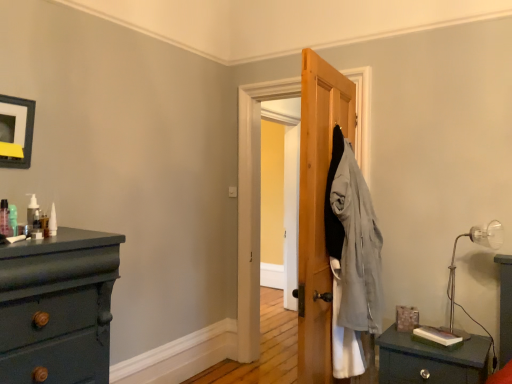
The width and height of the screenshot is (512, 384). I want to click on matte black nightstand at lower right, so click(431, 360).

Based on the photo, what is the approximate height of matte black nightstand at lower right?

matte black nightstand at lower right is 15.87 inches tall.

What do you see at coordinates (16, 131) in the screenshot? This screenshot has height=384, width=512. I see `matte black picture frame at upper left` at bounding box center [16, 131].

Where is `translucent plastic pump at left, which is the 3th toiletry from back to front`? Image resolution: width=512 pixels, height=384 pixels. translucent plastic pump at left, which is the 3th toiletry from back to front is located at coordinates (5, 219).

The image size is (512, 384). What do you see at coordinates (52, 222) in the screenshot? I see `white matte bottle at upper left, the 3th toiletry from the left` at bounding box center [52, 222].

This screenshot has height=384, width=512. I want to click on translucent plastic pump at left, which ranks as the second toiletry in right-to-left order, so click(x=32, y=211).

Locate an element on the screen. matte black nightstand at lower right is located at coordinates tap(431, 360).

What's the angular difference between translucent plastic pump at left, which ranks as the first toiletry in left-to-right order, and metallic silver table lamp at right's facing directions?

The angular difference between translucent plastic pump at left, which ranks as the first toiletry in left-to-right order, and metallic silver table lamp at right is 80.5 degrees.

Is translucent plastic pump at left, which is the 3th toiletry from back to front, wider than metallic silver table lamp at right?

No, translucent plastic pump at left, which is the 3th toiletry from back to front, is not wider than metallic silver table lamp at right.

From a real-world perspective, which toiletry is the 2nd one above the metallic silver table lamp at right? Please provide its 2D coordinates.

[(5, 219)]

Considering the relative sizes of translucent plastic pump at left, which ranks as the first toiletry in left-to-right order, and metallic silver table lamp at right in the image provided, is translucent plastic pump at left, which ranks as the first toiletry in left-to-right order, smaller than metallic silver table lamp at right?

Yes, translucent plastic pump at left, which ranks as the first toiletry in left-to-right order, is smaller than metallic silver table lamp at right.

Considering the sizes of objects translucent plastic pump at left, which is the 3th toiletry from back to front, and white matte bottle at upper left, the 3th toiletry from the left, in the image provided, who is taller, translucent plastic pump at left, which is the 3th toiletry from back to front, or white matte bottle at upper left, the 3th toiletry from the left,?

translucent plastic pump at left, which is the 3th toiletry from back to front, is taller.

Does translucent plastic pump at left, which is the third toiletry from right to left, come behind white matte bottle at upper left, the 3th toiletry from the left?

No.

Consider the image. Could white matte bottle at upper left, acting as the 1th toiletry starting from the back, be considered to be inside translucent plastic pump at left, which is the 3th toiletry from back to front?

Definitely not — white matte bottle at upper left, acting as the 1th toiletry starting from the back, is not inside translucent plastic pump at left, which is the 3th toiletry from back to front.

Visually, is translucent plastic pump at left, which is the third toiletry from right to left, positioned to the left or to the right of white matte bottle at upper left, acting as the 1th toiletry starting from the back?

Clearly, translucent plastic pump at left, which is the third toiletry from right to left, is on the left of white matte bottle at upper left, acting as the 1th toiletry starting from the back, in the image.

Based on the photo, considering the sizes of objects matte black picture frame at upper left and translucent plastic pump at left, which is the third toiletry from right to left, in the image provided, who is bigger, matte black picture frame at upper left or translucent plastic pump at left, which is the third toiletry from right to left,?

matte black picture frame at upper left.

In the image, is matte black picture frame at upper left on the left side or the right side of translucent plastic pump at left, which ranks as the first toiletry in front-to-back order?

Clearly, matte black picture frame at upper left is on the left of translucent plastic pump at left, which ranks as the first toiletry in front-to-back order, in the image.

Is point (10, 163) closer or farther from the camera than point (8, 216)?

Point (10, 163) appears to be farther away from the viewer than point (8, 216).

From a real-world perspective, who is located lower, matte black picture frame at upper left or translucent plastic pump at left, which ranks as the first toiletry in left-to-right order?

translucent plastic pump at left, which ranks as the first toiletry in left-to-right order, is physically lower.

Does metallic silver table lamp at right have a lesser width compared to white matte bottle at upper left, the 3th toiletry from the left?

In fact, metallic silver table lamp at right might be wider than white matte bottle at upper left, the 3th toiletry from the left.

Are metallic silver table lamp at right and white matte bottle at upper left, arranged as the first toiletry when viewed from the right, beside each other?

They are not placed beside each other.

Is point (489, 223) closer to viewer compared to point (55, 214)?

No, (489, 223) is behind (55, 214).

How far apart are metallic silver table lamp at right and white matte bottle at upper left, the 3th toiletry from the left?

metallic silver table lamp at right and white matte bottle at upper left, the 3th toiletry from the left, are 7.22 feet apart from each other.

The height and width of the screenshot is (384, 512). I want to click on nightstand in front of the metallic silver table lamp at right, so click(431, 360).

Considering the relative sizes of metallic silver table lamp at right and matte black nightstand at lower right in the image provided, is metallic silver table lamp at right taller than matte black nightstand at lower right?

Yes.

Looking at this image, is metallic silver table lamp at right positioned with its back to matte black nightstand at lower right?

No, metallic silver table lamp at right is not facing the opposite direction of matte black nightstand at lower right.

This screenshot has width=512, height=384. In order to click on picture frame located above the white matte bottle at upper left, the 3th toiletry from the left (from a real-world perspective) in this screenshot , I will do `click(16, 131)`.

How much distance is there between matte black picture frame at upper left and white matte bottle at upper left, arranged as the first toiletry when viewed from the right?

18.80 inches.

Considering their positions, is matte black picture frame at upper left located in front of or behind white matte bottle at upper left, placed as the third toiletry when sorted from front to back?

Clearly, matte black picture frame at upper left is in front of white matte bottle at upper left, placed as the third toiletry when sorted from front to back.

From the image's perspective, would you say matte black picture frame at upper left is positioned over white matte bottle at upper left, the 3th toiletry from the left?

Yes, from the image's perspective, matte black picture frame at upper left is over white matte bottle at upper left, the 3th toiletry from the left.

Is white matte bottle at upper left, acting as the 1th toiletry starting from the back, to the left or to the right of translucent plastic pump at left, marked as the 2th toiletry in a left-to-right arrangement, in the image?

From the image, it's evident that white matte bottle at upper left, acting as the 1th toiletry starting from the back, is to the right of translucent plastic pump at left, marked as the 2th toiletry in a left-to-right arrangement.

Where is `the 2nd toiletry positioned below the translucent plastic pump at left, acting as the second toiletry starting from the back (from the image's perspective)`? The width and height of the screenshot is (512, 384). the 2nd toiletry positioned below the translucent plastic pump at left, acting as the second toiletry starting from the back (from the image's perspective) is located at coordinates (52, 222).

From the image's perspective, between white matte bottle at upper left, placed as the third toiletry when sorted from front to back, and translucent plastic pump at left, marked as the 2th toiletry in a left-to-right arrangement, which one is located above?

translucent plastic pump at left, marked as the 2th toiletry in a left-to-right arrangement.

Does white matte bottle at upper left, arranged as the first toiletry when viewed from the right, have a lesser width compared to translucent plastic pump at left, which ranks as the second toiletry in right-to-left order?

Yes.

You are a GUI agent. You are given a task and a screenshot of the screen. Output one action in this format:
    pyautogui.click(x=<x>, y=<y>)
    Task: Click on the table lamp behind the translucent plastic pump at left, which ranks as the first toiletry in front-to-back order
    Image resolution: width=512 pixels, height=384 pixels.
    Given the screenshot: What is the action you would take?
    pyautogui.click(x=455, y=266)

You are a GUI agent. You are given a task and a screenshot of the screen. Output one action in this format:
    pyautogui.click(x=<x>, y=<y>)
    Task: Click on the toiletry below the translucent plastic pump at left, which is the third toiletry from right to left (from a real-world perspective)
    The height and width of the screenshot is (384, 512).
    Given the screenshot: What is the action you would take?
    pyautogui.click(x=52, y=222)

From the picture: Based on their spatial positions, is matte black picture frame at upper left or matte black nightstand at lower right closer to metallic silver table lamp at right?

matte black nightstand at lower right.

From the image, which object appears to be nearer to metallic silver table lamp at right, matte black nightstand at lower right or matte black picture frame at upper left?

Among the two, matte black nightstand at lower right is located nearer to metallic silver table lamp at right.

Estimate the real-world distances between objects in this image. Which object is closer to white matte bottle at upper left, arranged as the first toiletry when viewed from the right, matte black picture frame at upper left or matte black nightstand at lower right?

Based on the image, matte black picture frame at upper left appears to be nearer to white matte bottle at upper left, arranged as the first toiletry when viewed from the right.

Considering their positions, is matte black picture frame at upper left positioned closer to white matte bottle at upper left, arranged as the first toiletry when viewed from the right, than metallic silver table lamp at right?

Based on the image, matte black picture frame at upper left appears to be nearer to white matte bottle at upper left, arranged as the first toiletry when viewed from the right.

Which object lies further to the anchor point white matte bottle at upper left, acting as the 1th toiletry starting from the back, metallic silver table lamp at right or translucent plastic pump at left, which ranks as the first toiletry in front-to-back order?

The object further to white matte bottle at upper left, acting as the 1th toiletry starting from the back, is metallic silver table lamp at right.

Looking at the image, which one is located closer to white matte bottle at upper left, the 3th toiletry from the left, matte black nightstand at lower right or translucent plastic pump at left, acting as the second toiletry starting from the back?

Based on the image, translucent plastic pump at left, acting as the second toiletry starting from the back, appears to be nearer to white matte bottle at upper left, the 3th toiletry from the left.

Looking at the image, which one is located closer to white matte bottle at upper left, arranged as the first toiletry when viewed from the right, metallic silver table lamp at right or matte black nightstand at lower right?

Based on the image, matte black nightstand at lower right appears to be nearer to white matte bottle at upper left, arranged as the first toiletry when viewed from the right.

Looking at the image, which one is located closer to translucent plastic pump at left, acting as the second toiletry starting from the back, matte black nightstand at lower right or translucent plastic pump at left, which is the 3th toiletry from back to front?

translucent plastic pump at left, which is the 3th toiletry from back to front, is positioned closer to the anchor translucent plastic pump at left, acting as the second toiletry starting from the back.

Where is `toiletry situated between translucent plastic pump at left, acting as the second toiletry starting from the back, and matte black nightstand at lower right from left to right`? The height and width of the screenshot is (384, 512). toiletry situated between translucent plastic pump at left, acting as the second toiletry starting from the back, and matte black nightstand at lower right from left to right is located at coordinates (52, 222).

In order to click on toiletry between matte black picture frame at upper left and translucent plastic pump at left, which ranks as the first toiletry in front-to-back order, in the up-down direction in this screenshot , I will do `click(32, 211)`.

Locate an element on the screen. toiletry between translucent plastic pump at left, which ranks as the second toiletry in right-to-left order, and metallic silver table lamp at right from left to right is located at coordinates (52, 222).

Identify the location of nightstand between translucent plastic pump at left, marked as the 2th toiletry in a left-to-right arrangement, and metallic silver table lamp at right, in the horizontal direction. The height and width of the screenshot is (384, 512). click(x=431, y=360).